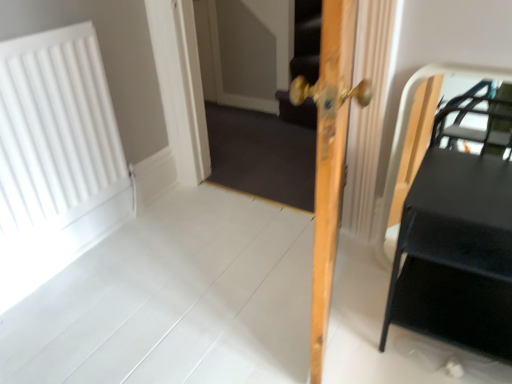
What do you see at coordinates (55, 132) in the screenshot? The image size is (512, 384). I see `white matte radiator at left` at bounding box center [55, 132].

You are a GUI agent. You are given a task and a screenshot of the screen. Output one action in this format:
    pyautogui.click(x=<x>, y=<y>)
    Task: Click on the light wood door at center
    
    Given the screenshot: What is the action you would take?
    pyautogui.click(x=329, y=154)

Measure the distance between black matte table at right and camera.

The distance of black matte table at right from camera is 1.03 meters.

Locate an element on the screen. white matte radiator at left is located at coordinates (55, 132).

From a real-world perspective, which is physically above, wooden screen door at center or black matte table at right?

wooden screen door at center, from a real-world perspective.

From the image's perspective, is wooden screen door at center above black matte table at right?

Indeed, from the image's perspective, wooden screen door at center is shown above black matte table at right.

From the picture: Which is correct: wooden screen door at center is inside black matte table at right, or outside of it?

wooden screen door at center exists outside the volume of black matte table at right.

Which of these two, wooden screen door at center or black matte table at right, is smaller?

With smaller size is black matte table at right.

Considering the sizes of objects white matte radiator at left and black matte table at right in the image provided, who is bigger, white matte radiator at left or black matte table at right?

black matte table at right is bigger.

From the image's perspective, is white matte radiator at left above or below black matte table at right?

Based on their image positions, white matte radiator at left is located above black matte table at right.

Can you confirm if white matte radiator at left is shorter than black matte table at right?

Incorrect, the height of white matte radiator at left does not fall short of that of black matte table at right.

Which is behind, white matte radiator at left or black matte table at right?

white matte radiator at left is more distant.

Looking at this image, would you say wooden screen door at center is a long distance from light wood door at center?

Absolutely, wooden screen door at center is distant from light wood door at center.

From a real-world perspective, which is physically below, wooden screen door at center or light wood door at center?

In real-world perspective, wooden screen door at center is lower.

Considering the positions of objects light wood door at center and wooden screen door at center in the image provided, who is in front, light wood door at center or wooden screen door at center?

Positioned in front is light wood door at center.

Where is `door above the wooden screen door at center (from a real-world perspective)`? This screenshot has height=384, width=512. door above the wooden screen door at center (from a real-world perspective) is located at coordinates (329, 154).

Does light wood door at center have a greater width compared to wooden screen door at center?

Yes.

Which object is positioned more to the right, light wood door at center or wooden screen door at center?

light wood door at center.

Considering the sizes of light wood door at center and white matte radiator at left in the image, is light wood door at center wider or thinner than white matte radiator at left?

light wood door at center is wider than white matte radiator at left.

Measure the distance between light wood door at center and white matte radiator at left.

They are 1.01 meters apart.

From a real-world perspective, is light wood door at center on white matte radiator at left?

Yes, from a real-world perspective, light wood door at center is over white matte radiator at left

Is point (319, 130) more distant than point (86, 123)?

No, (319, 130) is in front of (86, 123).

Does white matte radiator at left contain wooden screen door at center?

No.

Would you consider white matte radiator at left to be distant from wooden screen door at center?

Yes, white matte radiator at left and wooden screen door at center are located far from each other.

Looking at this image, what's the angular difference between white matte radiator at left and wooden screen door at center's facing directions?

91.2 degrees separate the facing orientations of white matte radiator at left and wooden screen door at center.

How distant is black matte table at right from light wood door at center?

black matte table at right is 15.18 inches from light wood door at center.

Are black matte table at right and light wood door at center far apart?

Actually, black matte table at right and light wood door at center are a little close together.

Which is closer to the camera, (395, 260) or (321, 121)?

Positioned in front is point (321, 121).

Locate an element on the screen. table on the right of light wood door at center is located at coordinates (456, 254).

Image resolution: width=512 pixels, height=384 pixels. In the image, there is a black matte table at right. Find the location of `screen door above it (from the image's perspective)`. screen door above it (from the image's perspective) is located at coordinates pos(259,99).

I want to click on radiator above the black matte table at right (from a real-world perspective), so click(55, 132).

Considering their positions, is black matte table at right positioned closer to white matte radiator at left than wooden screen door at center?

wooden screen door at center is closer to white matte radiator at left.

Looking at the image, which one is located further to white matte radiator at left, light wood door at center or wooden screen door at center?

The object further to white matte radiator at left is wooden screen door at center.

When comparing their distances from white matte radiator at left, does wooden screen door at center or light wood door at center seem closer?

light wood door at center lies closer to white matte radiator at left than the other object.

Considering their positions, is wooden screen door at center positioned further to white matte radiator at left than black matte table at right?

Based on the image, black matte table at right appears to be further to white matte radiator at left.

Estimate the real-world distances between objects in this image. Which object is closer to light wood door at center, wooden screen door at center or black matte table at right?

black matte table at right lies closer to light wood door at center than the other object.

Consider the image. Estimate the real-world distances between objects in this image. Which object is further from light wood door at center, black matte table at right or white matte radiator at left?

The object further to light wood door at center is white matte radiator at left.

Estimate the real-world distances between objects in this image. Which object is further from black matte table at right, wooden screen door at center or white matte radiator at left?

white matte radiator at left.

When comparing their distances from light wood door at center, does white matte radiator at left or black matte table at right seem closer?

black matte table at right lies closer to light wood door at center than the other object.

What are the coordinates of `screen door situated between white matte radiator at left and light wood door at center from left to right` in the screenshot? It's located at tap(259, 99).

In order to click on screen door between white matte radiator at left and black matte table at right in the horizontal direction in this screenshot , I will do `click(259, 99)`.

Find the location of a particular element. This screenshot has width=512, height=384. door between white matte radiator at left and black matte table at right from left to right is located at coordinates (329, 154).

Find the location of a particular element. Image resolution: width=512 pixels, height=384 pixels. table between light wood door at center and wooden screen door at center in the front-back direction is located at coordinates (456, 254).